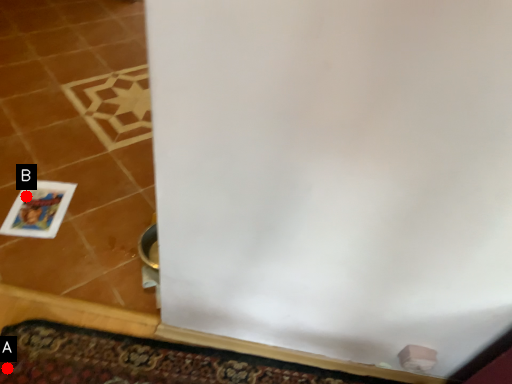
Question: Two points are circled on the image, labeled by A and B beside each circle. Which of the following is the closest to the observer?

Choices:
 (A) A is closer
 (B) B is closer

Answer: (A)